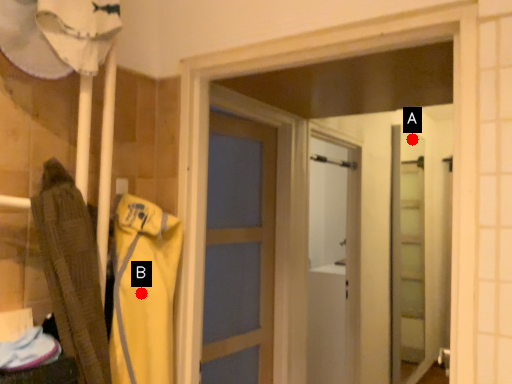
Question: Two points are circled on the image, labeled by A and B beside each circle. Which point is closer to the camera?

Choices:
 (A) A is closer
 (B) B is closer

Answer: (B)